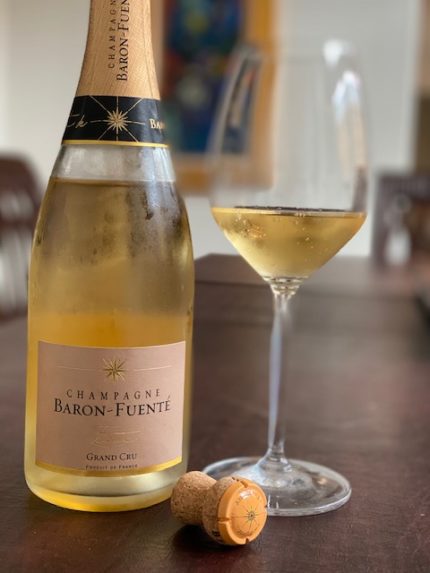
The width and height of the screenshot is (430, 573). I want to click on table champagne bottle and glass are sitting on, so click(x=344, y=391).